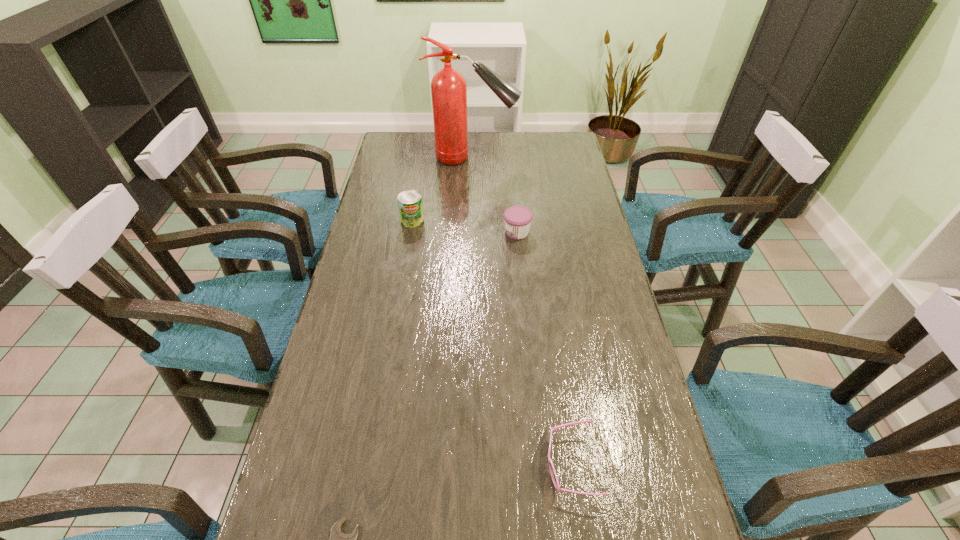
Where is `the second closest object to the second shortest object`? the second closest object to the second shortest object is located at coordinates (517, 219).

Identify which object is the second nearest to the jam. Please provide its 2D coordinates. Your answer should be formatted as a tuple, i.e. [(x, y)], where the tuple contains the x and y coordinates of a point satisfying the conditions above.

[(448, 87)]